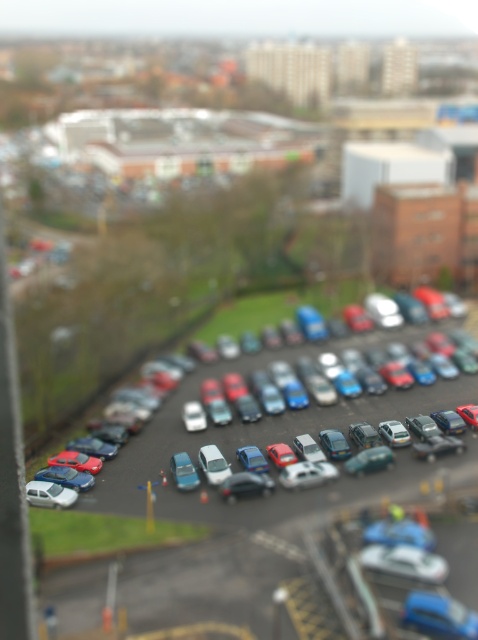
Which is more to the left, metallic silver cars at center or metallic silver car at center?

metallic silver car at center is more to the left.

Which is behind, point (184, 397) or point (194, 472)?

The point (184, 397) is behind.

You are a GUI agent. You are given a task and a screenshot of the screen. Output one action in this format:
    pyautogui.click(x=<x>, y=<y>)
    Task: Click on the metallic silver cars at center
    This screenshot has width=478, height=640.
    Given the screenshot: What is the action you would take?
    pyautogui.click(x=242, y=522)

Consider the image. Is metallic silver car at center bigger than metallic blue car at center?

Correct, metallic silver car at center is larger in size than metallic blue car at center.

Describe the element at coordinates (184, 472) in the screenshot. I see `metallic silver car at center` at that location.

Between point (176, 458) and point (477, 413), which one is positioned in front?

Positioned in front is point (176, 458).

Where is `metallic silver car at center`? This screenshot has height=640, width=478. metallic silver car at center is located at coordinates (184, 472).

Does metallic silver cars at center have a smaller size compared to metallic blue car at center?

No.

From the picture: Is metallic silver cars at center closer to camera compared to metallic blue car at center?

Yes, it is.

Find the location of a particular element. Image resolution: width=478 pixels, height=640 pixels. metallic silver cars at center is located at coordinates (242, 522).